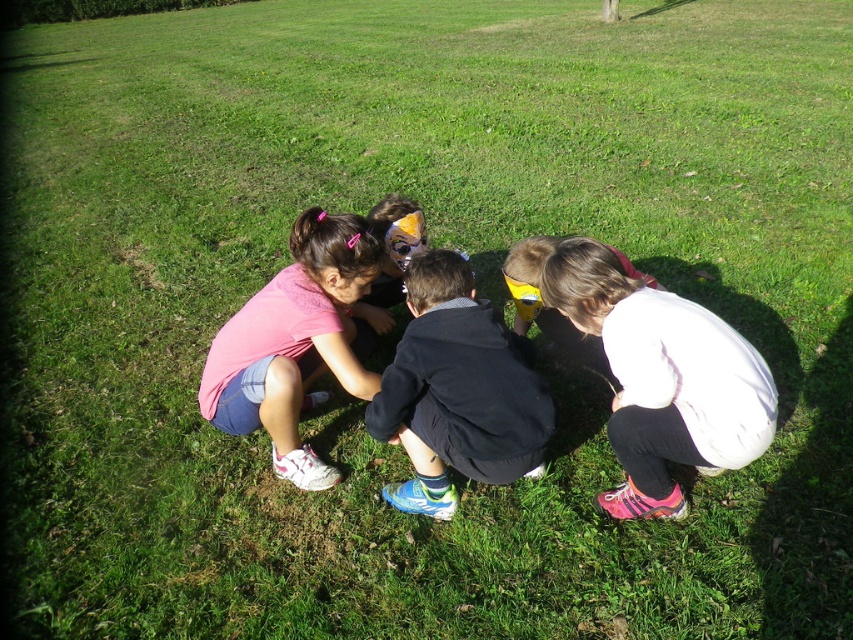
Question: Which point is farther to the camera?

Choices:
 (A) pink fabric shirt at center
 (B) white matte jacket at lower right
 (C) black matte jacket at center

Answer: (A)

Question: Which object appears closest to the camera in this image?

Choices:
 (A) pink fabric shirt at center
 (B) black matte jacket at center
 (C) white matte jacket at lower right

Answer: (C)

Question: Can you confirm if white matte jacket at lower right is smaller than pink fabric shirt at center?

Choices:
 (A) no
 (B) yes

Answer: (B)

Question: Which point is closer to the camera?

Choices:
 (A) (345, 298)
 (B) (657, 305)
 (C) (467, 400)

Answer: (C)

Question: Does white matte jacket at lower right have a smaller size compared to pink fabric shirt at center?

Choices:
 (A) no
 (B) yes

Answer: (B)

Question: Observing the image, what is the correct spatial positioning of white matte jacket at lower right in reference to pink fabric shirt at center?

Choices:
 (A) left
 (B) right

Answer: (B)